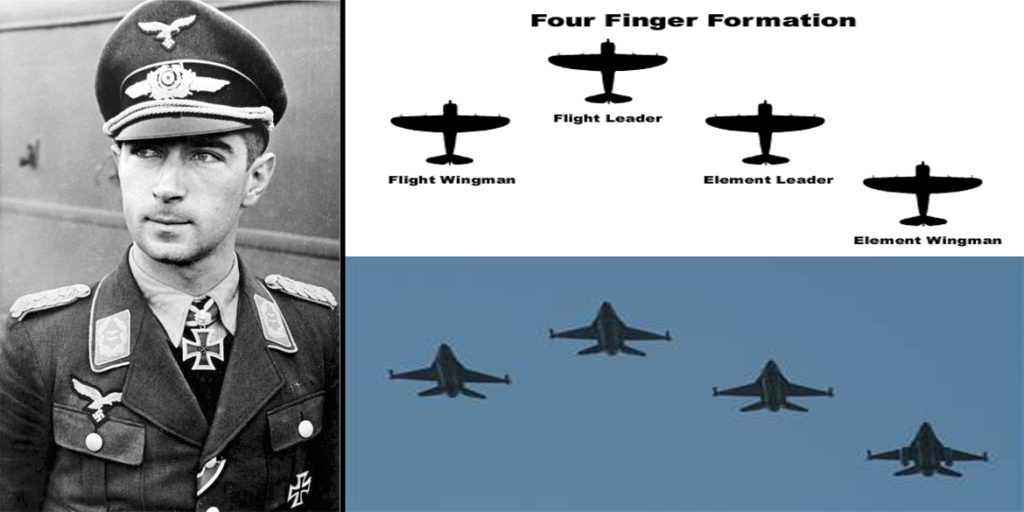
Locate an element on the screen. wall is located at coordinates (39, 71).